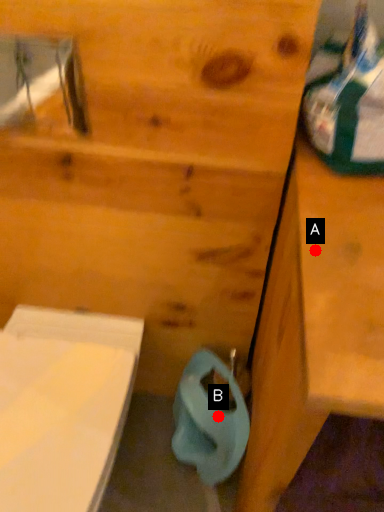
Question: Two points are circled on the image, labeled by A and B beside each circle. Which point is closer to the camera?

Choices:
 (A) A is closer
 (B) B is closer

Answer: (A)